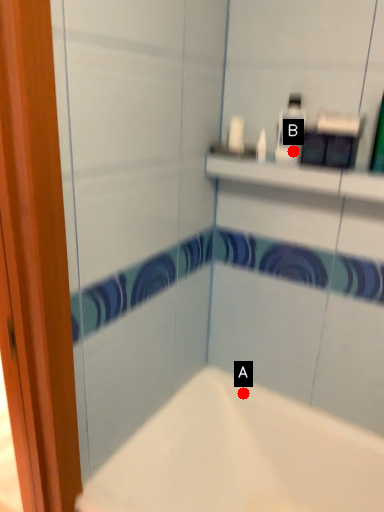
Question: Two points are circled on the image, labeled by A and B beside each circle. Which point appears farthest from the camera in this image?

Choices:
 (A) A is further
 (B) B is further

Answer: (A)